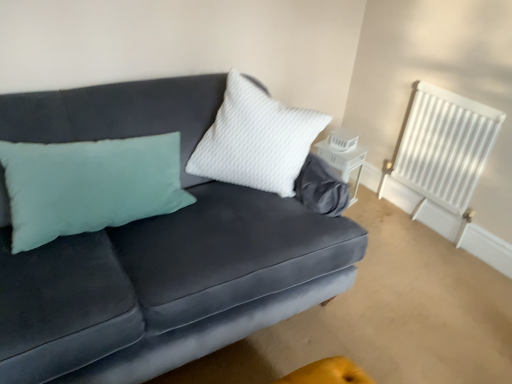
Question: Does white matte lantern at center appear on the left side of velvet dark blue couch at center?

Choices:
 (A) no
 (B) yes

Answer: (A)

Question: From a real-world perspective, does white matte lantern at center sit lower than velvet dark blue couch at center?

Choices:
 (A) no
 (B) yes

Answer: (B)

Question: Does white matte lantern at center contain velvet dark blue couch at center?

Choices:
 (A) no
 (B) yes

Answer: (A)

Question: Considering the relative sizes of white matte lantern at center and velvet dark blue couch at center in the image provided, is white matte lantern at center bigger than velvet dark blue couch at center?

Choices:
 (A) yes
 (B) no

Answer: (B)

Question: Does white matte lantern at center come in front of velvet dark blue couch at center?

Choices:
 (A) yes
 (B) no

Answer: (B)

Question: From the image's perspective, is white matte lantern at center located beneath velvet dark blue couch at center?

Choices:
 (A) yes
 (B) no

Answer: (B)

Question: Is the depth of white painted metal radiator at upper right less than that of white matte lantern at center?

Choices:
 (A) no
 (B) yes

Answer: (B)

Question: Considering the relative sizes of white painted metal radiator at upper right and white matte lantern at center in the image provided, is white painted metal radiator at upper right taller than white matte lantern at center?

Choices:
 (A) no
 (B) yes

Answer: (B)

Question: Is white painted metal radiator at upper right positioned with its back to white matte lantern at center?

Choices:
 (A) no
 (B) yes

Answer: (A)

Question: Is white painted metal radiator at upper right to the left of white matte lantern at center from the viewer's perspective?

Choices:
 (A) yes
 (B) no

Answer: (B)

Question: Considering the relative sizes of white painted metal radiator at upper right and white matte lantern at center in the image provided, is white painted metal radiator at upper right smaller than white matte lantern at center?

Choices:
 (A) no
 (B) yes

Answer: (A)

Question: Is white matte lantern at center a part of white painted metal radiator at upper right?

Choices:
 (A) no
 (B) yes

Answer: (A)

Question: Can you confirm if white painted metal radiator at upper right is positioned to the left of velvet dark blue couch at center?

Choices:
 (A) no
 (B) yes

Answer: (A)